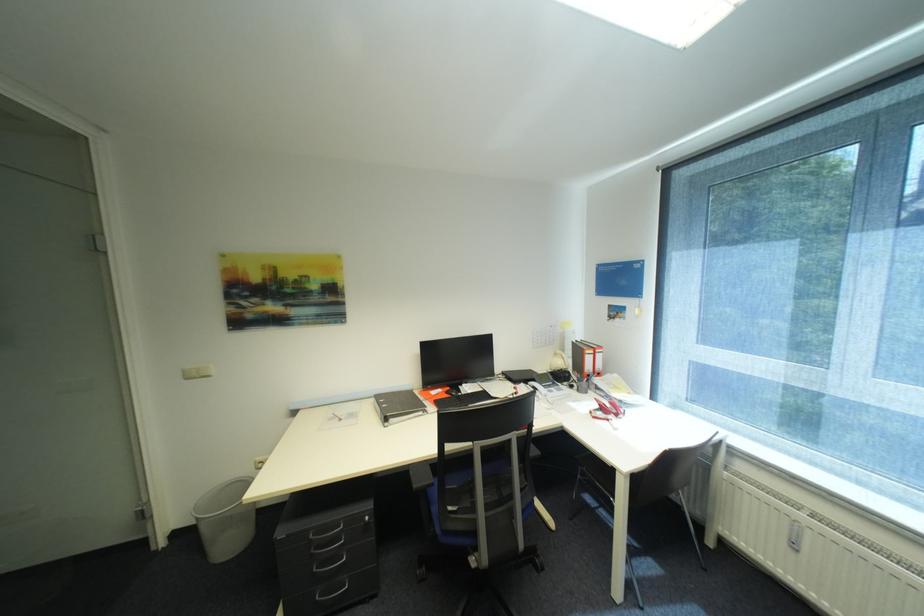
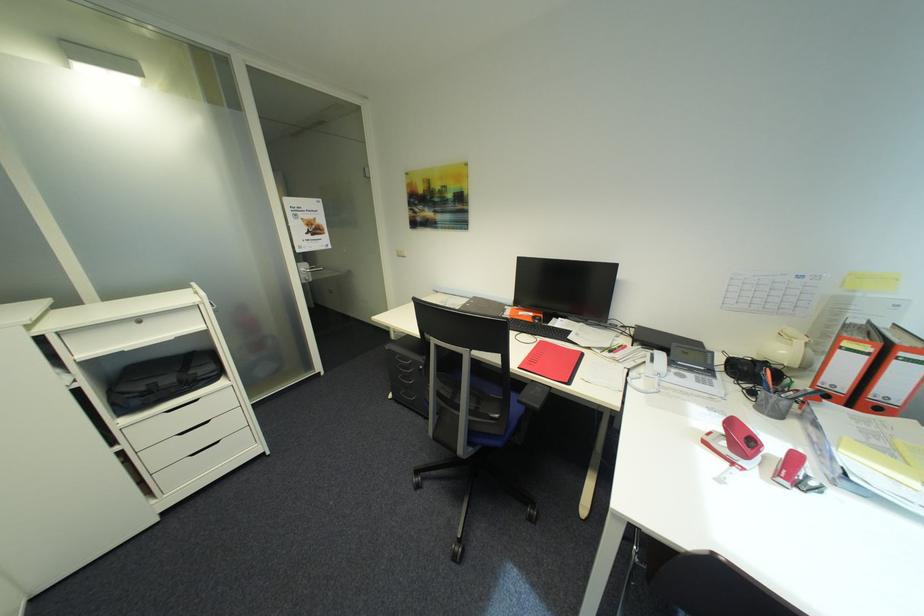
Locate, in the second image, the point that corresponds to the point at 600,357 in the first image.

(872, 359)